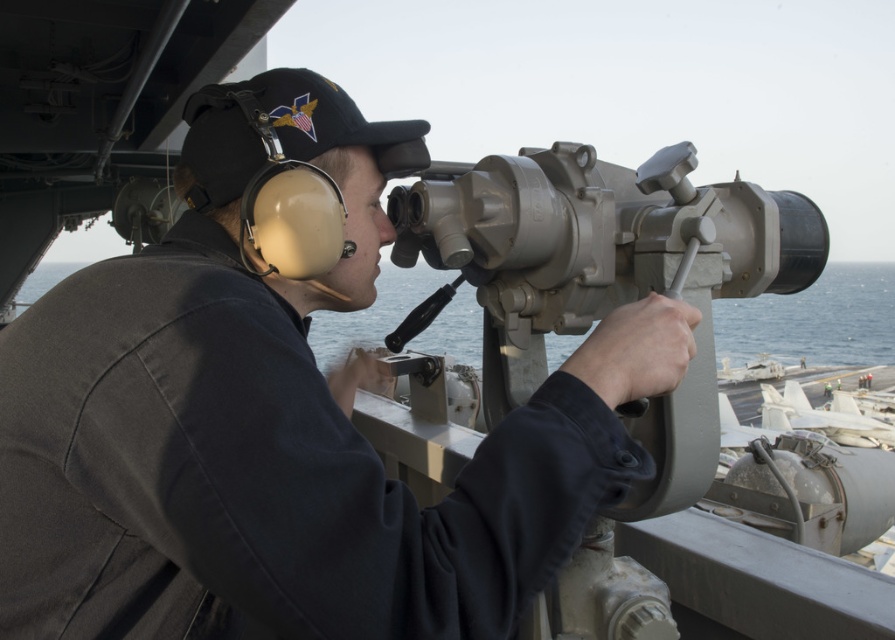
You are a crew member on the ship and need to access the matte gray telescope at center. Is the matte black uniform at center blocking your path to it?

The matte black uniform at center is positioned over the matte gray telescope at center, so yes, the uniform is blocking the path to the telescope.

You are a crew member on the ship and need to locate the telescope for navigation. According to the scene, where would you find the matte gray telescope at center in relation to the matte black uniform at center?

The matte gray telescope at center is to the right of the matte black uniform at center.

You are standing on the deck of the ship and notice the matte black uniform at center and the matte gray telescope at center. Which object is positioned closer to you?

The matte black uniform at center is closer to the viewer than the matte gray telescope at center.